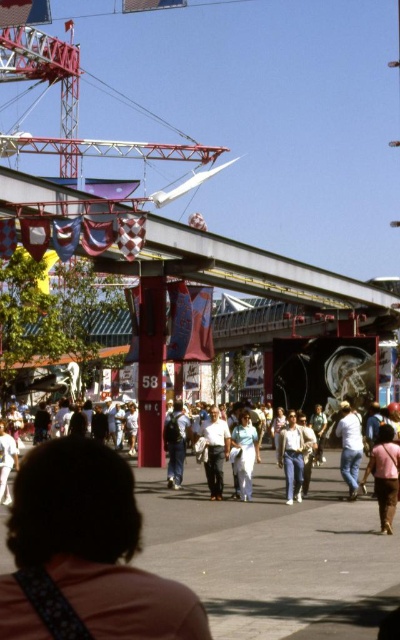
Question: Among these points, which one is nearest to the camera?

Choices:
 (A) (170, 412)
 (B) (208, 419)

Answer: (A)

Question: Can you confirm if denim jeans at center is wider than light blue fabric pants at center?

Choices:
 (A) yes
 (B) no

Answer: (A)

Question: Which point is farther to the camera?

Choices:
 (A) light blue fabric pants at center
 (B) light blue jeans at center
 (C) white cotton shirt at center

Answer: (C)

Question: Is pink fabric shirt at lower center below denim jeans at center?

Choices:
 (A) no
 (B) yes

Answer: (A)

Question: Is light blue fabric pants at center behind denim pants at center?

Choices:
 (A) yes
 (B) no

Answer: (B)

Question: Which of these objects is positioned closest to the denim jeans at center?

Choices:
 (A) denim pants at center
 (B) pink fabric at center
 (C) light blue fabric pants at center
 (D) white cotton shirt at center

Answer: (C)